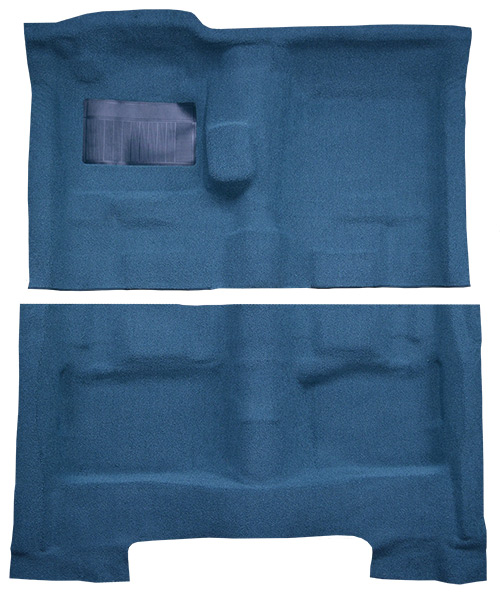
The image size is (500, 594). I want to click on raised area, so click(242, 151), click(261, 419), click(155, 336), click(350, 328), click(94, 65).